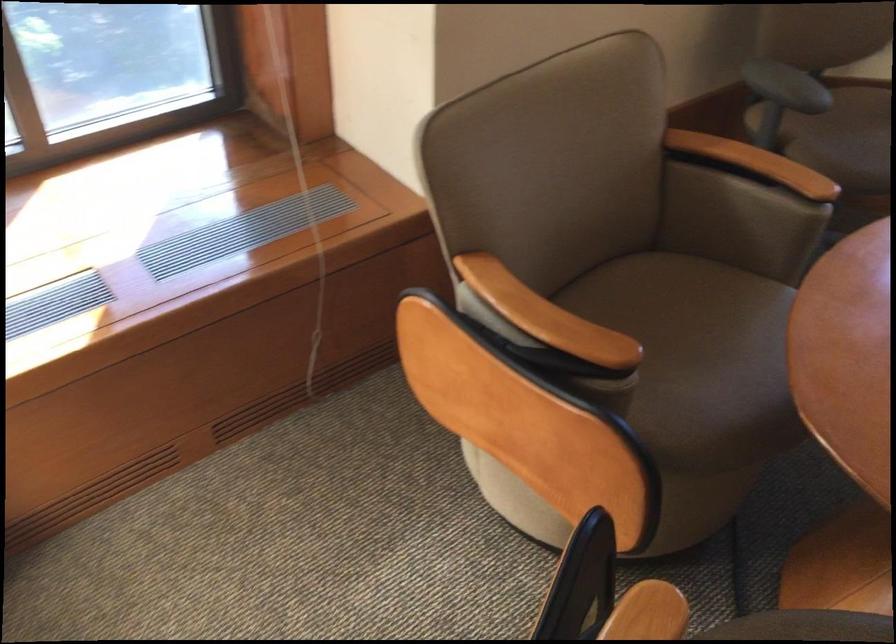
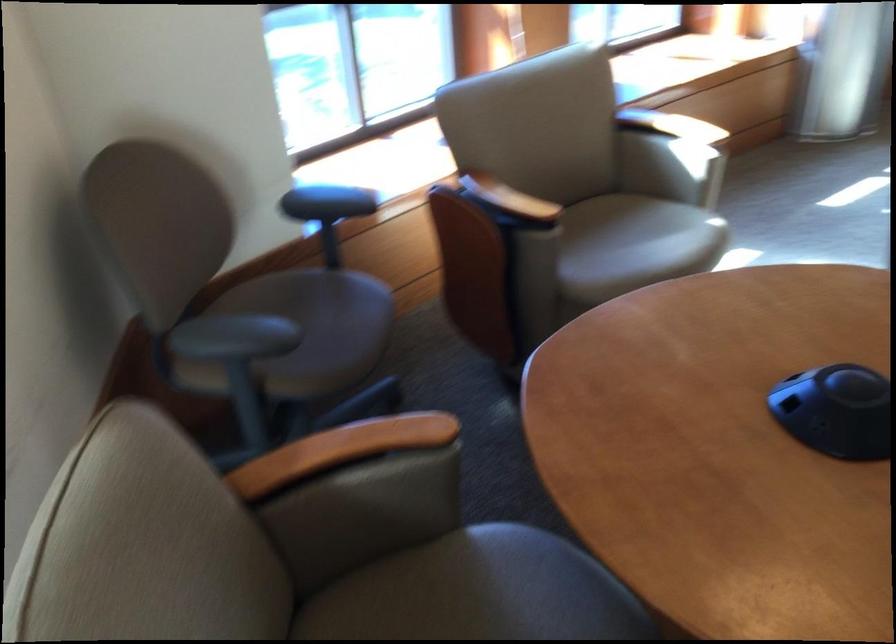
Question: Based on the continuous images, in which direction is the camera rotating? Reply with the corresponding letter.

Choices:
 (A) Left
 (B) Right
 (C) Up
 (D) Down

Answer: (B)